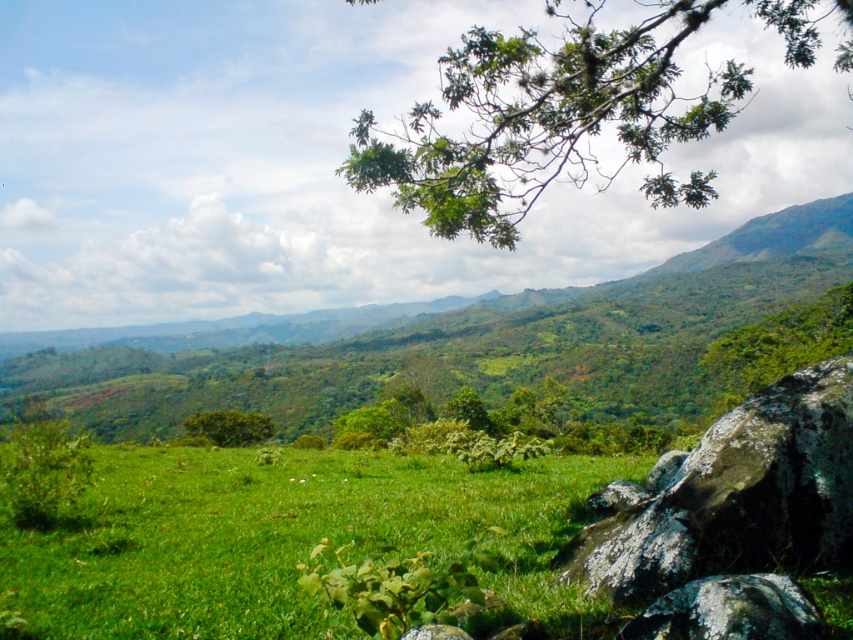
Does green leafy bush at lower left have a greater height compared to green leafy bush at center?

Yes, green leafy bush at lower left is taller than green leafy bush at center.

Is green leafy bush at lower left smaller than green leafy bush at center?

Actually, green leafy bush at lower left might be larger than green leafy bush at center.

Identify the location of green leafy bush at lower left. The height and width of the screenshot is (640, 853). click(x=44, y=472).

Can you confirm if green grassy field at lower right is taller than lichen-covered rock at lower right?

Correct, green grassy field at lower right is much taller as lichen-covered rock at lower right.

Find the location of a particular element. Image resolution: width=853 pixels, height=640 pixels. green grassy field at lower right is located at coordinates (288, 540).

Who is more forward, (x=396, y=532) or (x=641, y=516)?

Point (x=641, y=516) is in front.

I want to click on green grassy field at lower right, so click(x=288, y=540).

Image resolution: width=853 pixels, height=640 pixels. What do you see at coordinates (738, 497) in the screenshot?
I see `lichen-covered rock at lower right` at bounding box center [738, 497].

Is point (625, 593) less distant than point (184, 426)?

That is True.

You are a GUI agent. You are given a task and a screenshot of the screen. Output one action in this format:
    pyautogui.click(x=<x>, y=<y>)
    Task: Click on the lichen-covered rock at lower right
    Image resolution: width=853 pixels, height=640 pixels.
    Given the screenshot: What is the action you would take?
    pyautogui.click(x=738, y=497)